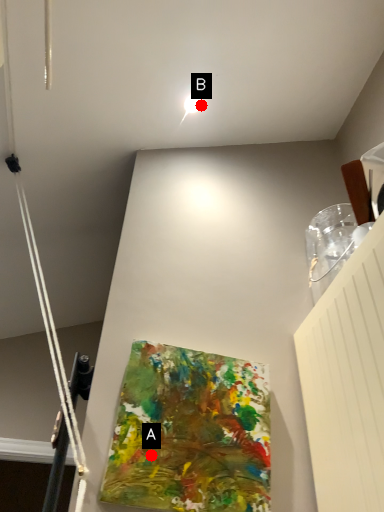
Question: Two points are circled on the image, labeled by A and B beside each circle. Among these points, which one is farthest from the camera?

Choices:
 (A) A is further
 (B) B is further

Answer: (B)